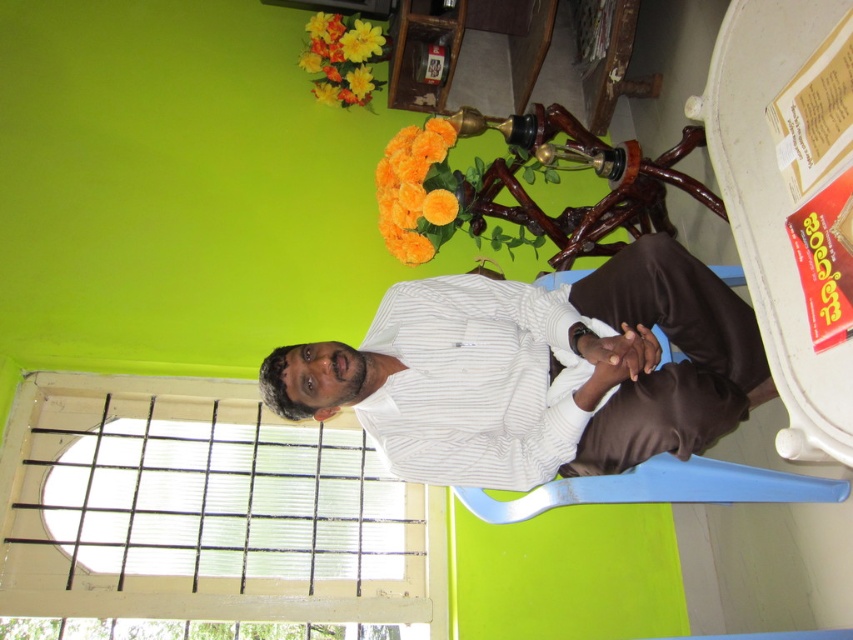
You are an interior designer planning to place a new painting on the wall behind the man. The painting is 1 meter wide. Considering the white striped shirt at center and the white striped dress shirt at center, which one is closer to the wall so that the painting won

The white striped shirt at center is in front of the white striped dress shirt at center, meaning the dress shirt is closer to the wall. Therefore, the painting should be placed behind the white striped dress shirt at center to ensure it aligns properly with the wall.

You are standing in the room depicted in the scene. There is a point labeled as point (743, 356). Can you reach this point without moving your body?

The point (743, 356) is 1.63 meters from the viewer, so you cannot reach it without moving your body since it is too far away.

You are an interior designer trying to arrange two white striped shirts in a room with a vibrant green wall. You have the white striped shirt at center and the white striped dress shirt at center. Which shirt is located to the right of the other?

The white striped shirt at center is positioned on the right side of white striped dress shirt at center.